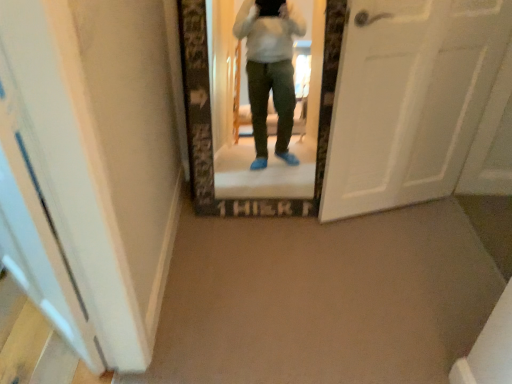
Describe the element at coordinates (409, 99) in the screenshot. I see `white matte door at right` at that location.

Image resolution: width=512 pixels, height=384 pixels. Find the location of `white matte door at right`. white matte door at right is located at coordinates (409, 99).

Locate an element on the screen. Image resolution: width=512 pixels, height=384 pixels. white matte door at right is located at coordinates (409, 99).